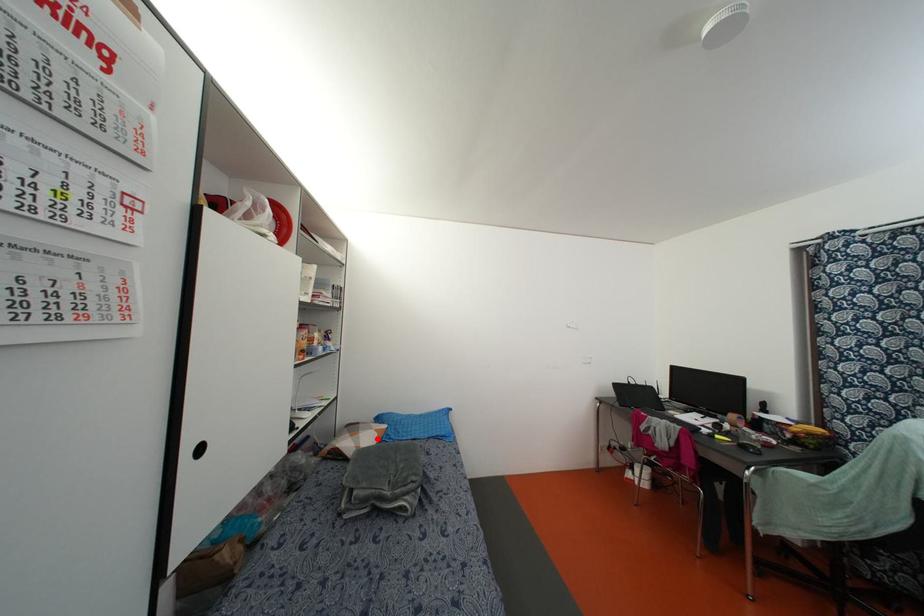
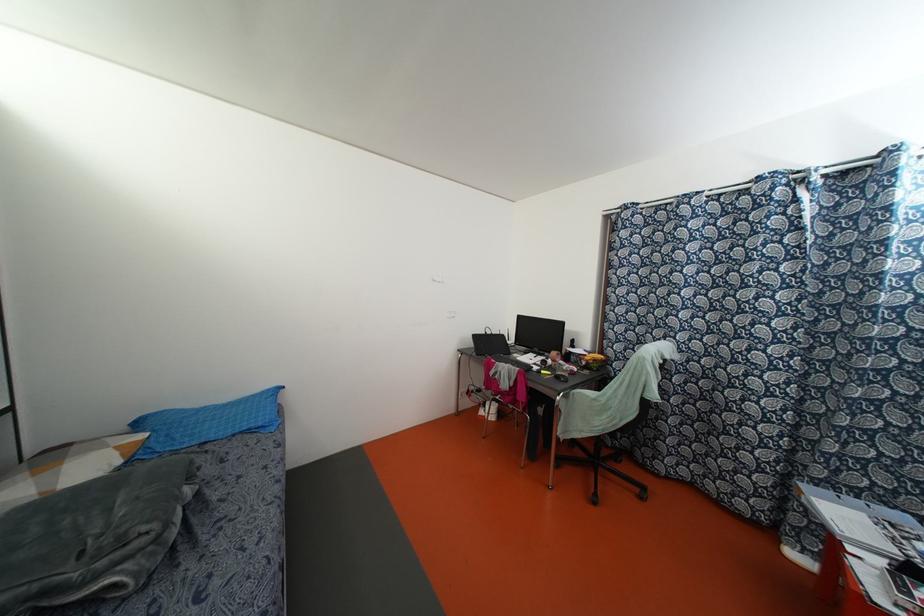
In the second image, find the point that corresponds to the highlighted location in the first image.

(118, 461)